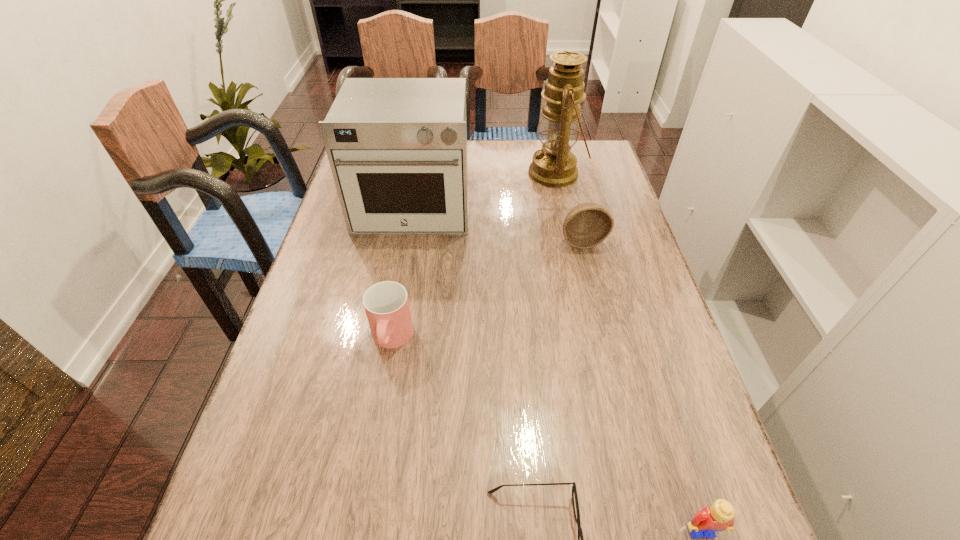
The height and width of the screenshot is (540, 960). In order to click on oil lamp in this screenshot , I will do click(x=554, y=165).

Where is `toaster oven`? The image size is (960, 540). toaster oven is located at coordinates (397, 147).

Identify the location of bowl. The height and width of the screenshot is (540, 960). (586, 225).

You are a GUI agent. You are given a task and a screenshot of the screen. Output one action in this format:
    pyautogui.click(x=<x>, y=<y>)
    Task: Click on the cup
    
    Given the screenshot: What is the action you would take?
    pyautogui.click(x=386, y=304)

The width and height of the screenshot is (960, 540). I want to click on vacant space located on the front of the oil lamp, so click(x=580, y=283).

Identify the location of free space located on the front panel of the toaster oven. (391, 339).

Locate an element on the screen. The height and width of the screenshot is (540, 960). free space located on the back of the bowl is located at coordinates (571, 195).

I want to click on vacant space located 0.140m on the side of the fourth farthest object with the handle, so click(376, 428).

Image resolution: width=960 pixels, height=540 pixels. Identify the location of object located at the far edge. (554, 165).

Locate an element on the screen. The image size is (960, 540). object at the left edge is located at coordinates (397, 147).